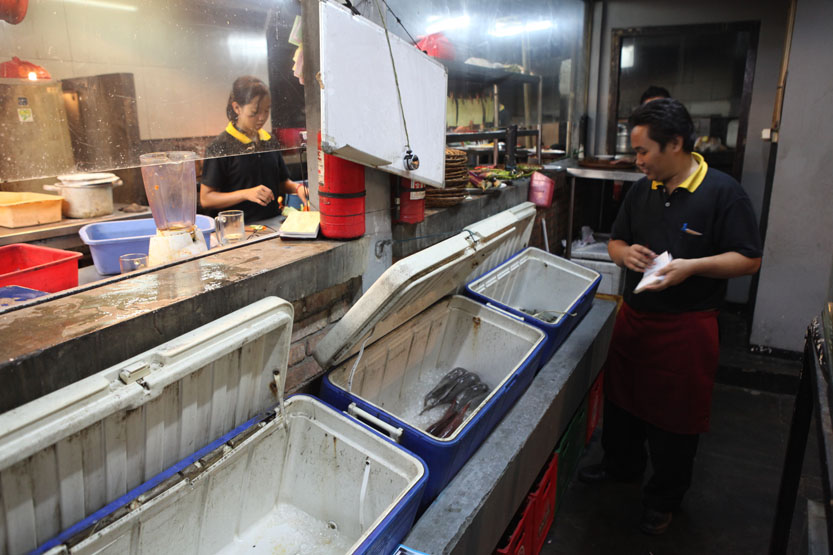
Image resolution: width=833 pixels, height=555 pixels. What are the coordinates of `kitchen area` in the screenshot? It's located at (100, 231), (496, 125).